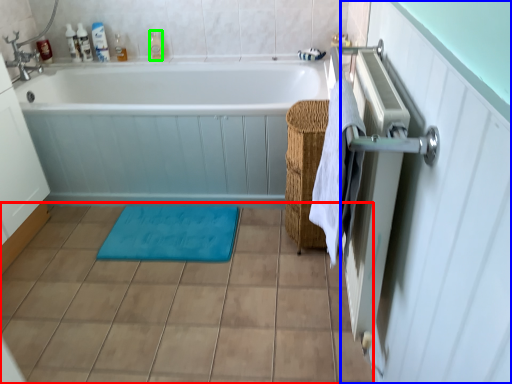
Question: Which object is positioned closest to ceramic tile (highlighted by a red box)? Select from screen door (highlighted by a blue box) and toiletry (highlighted by a green box).

Choices:
 (A) screen door
 (B) toiletry

Answer: (A)